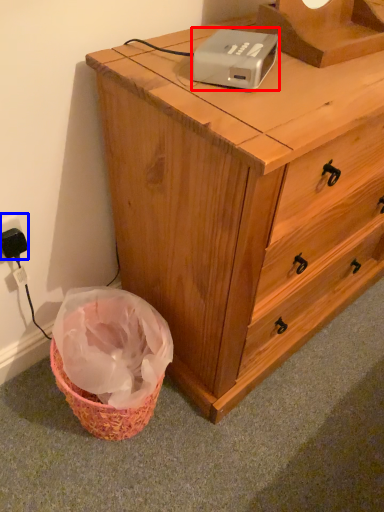
Question: Which point is closer to the camera, gadget (highlighted by a red box) or electric outlet (highlighted by a blue box)?

Choices:
 (A) gadget
 (B) electric outlet

Answer: (A)